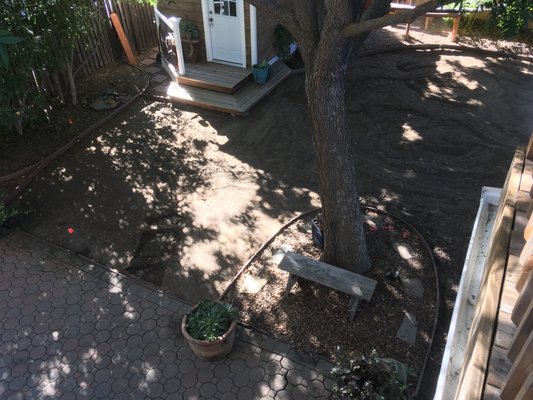
At what (x,y) coordinates should I click in order to perform the action: click on door. Please return your answer as a coordinate pair (x, y). This screenshot has width=533, height=400. Looking at the image, I should click on (233, 41).